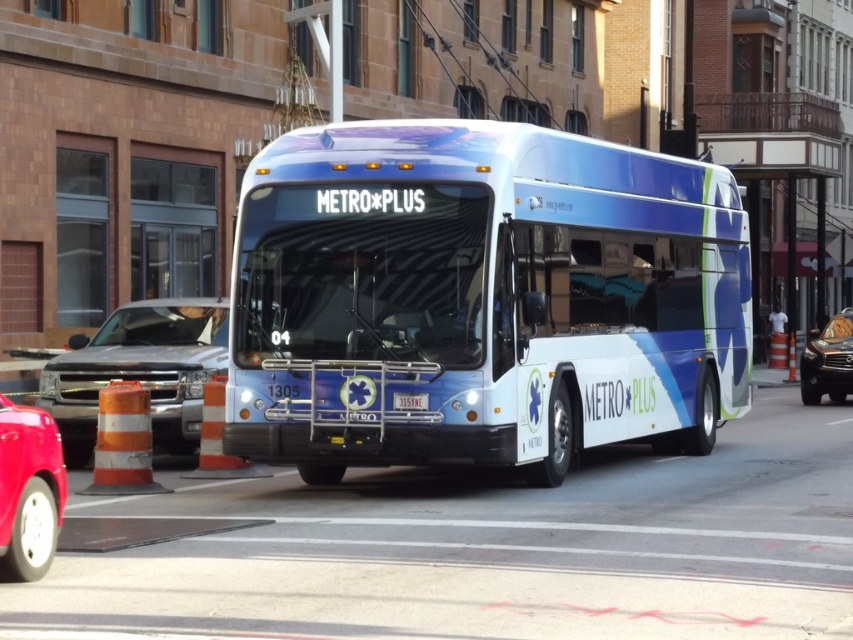
You are a delivery person needing to place a large package between the shiny metallic bus at center and the blue metallic license plate at center. The package is 3 meters long. Can you fit it in the space between them?

The distance between the shiny metallic bus at center and the blue metallic license plate at center is 2.85 meters. Since the package is 3 meters long, it is longer than the available space, so it won

You are a pedestrian standing at the crosswalk and see the shiny red car at lower left and the shiny silver suv at right. Which vehicle is closer to the left side of the crosswalk?

The shiny red car at lower left is closer to the left side of the crosswalk because it is positioned to the left of the shiny silver suv at right.